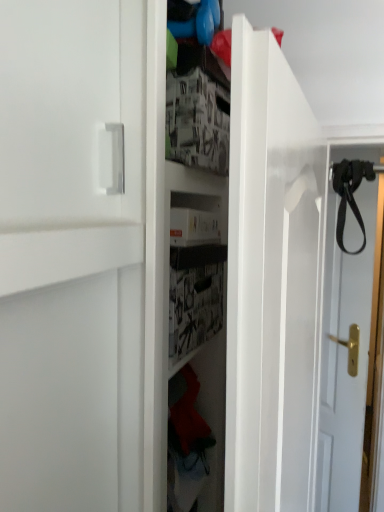
This screenshot has width=384, height=512. What do you see at coordinates (344, 356) in the screenshot?
I see `black leather strap at right` at bounding box center [344, 356].

The width and height of the screenshot is (384, 512). I want to click on black leather strap at right, so click(344, 356).

Measure the distance between black leather strap at right and camera.

1.17 meters.

Locate an element on the screen. The height and width of the screenshot is (512, 384). black leather strap at upper right is located at coordinates (350, 194).

In the scene shown: What is the approximate height of black leather strap at upper right?

The height of black leather strap at upper right is 11.22 inches.

Describe the element at coordinates (350, 194) in the screenshot. This screenshot has height=512, width=384. I see `black leather strap at upper right` at that location.

Locate an element on the screen. black leather strap at right is located at coordinates (344, 356).

Can you confirm if black leather strap at upper right is positioned to the left of black leather strap at right?

Yes.

Relative to black leather strap at right, is black leather strap at upper right in front or behind?

black leather strap at upper right is positioned closer to the viewer than black leather strap at right.

Considering the positions of points (372, 170) and (334, 366), is point (372, 170) closer to camera compared to point (334, 366)?

That is True.

From the image's perspective, which one is positioned higher, black leather strap at upper right or black leather strap at right?

black leather strap at upper right appears higher in the image.

From a real-world perspective, between black leather strap at upper right and black leather strap at right, who is vertically higher?

From a 3D spatial view, black leather strap at upper right is above.

Does black leather strap at upper right have a greater width compared to black leather strap at right?

No, black leather strap at upper right is not wider than black leather strap at right.

Which of these two, black leather strap at upper right or black leather strap at right, stands shorter?

With less height is black leather strap at upper right.

Does black leather strap at upper right have a larger size compared to black leather strap at right?

No, black leather strap at upper right is not bigger than black leather strap at right.

Is black leather strap at upper right inside or outside of black leather strap at right?

black leather strap at upper right exists outside the volume of black leather strap at right.

Is black leather strap at upper right far away from black leather strap at right?

No, black leather strap at upper right is in close proximity to black leather strap at right.

Is black leather strap at upper right aimed at black leather strap at right?

No, black leather strap at upper right is not oriented towards black leather strap at right.

Locate an element on the screen. door lying behind the black leather strap at upper right is located at coordinates (344, 356).

Considering the relative positions of black leather strap at right and black leather strap at upper right in the image provided, is black leather strap at right to the left or to the right of black leather strap at upper right?

In the image, black leather strap at right appears on the right side of black leather strap at upper right.

Considering their positions, is black leather strap at right located in front of or behind black leather strap at upper right?

black leather strap at right is behind black leather strap at upper right.

Which is nearer, (338,440) or (373,170)?

Point (338,440) is positioned farther from the camera compared to point (373,170).

From the image's perspective, does black leather strap at right appear lower than black leather strap at upper right?

Yes, from the image's perspective, black leather strap at right is below black leather strap at upper right.

From a real-world perspective, who is located higher, black leather strap at right or black leather strap at upper right?

black leather strap at upper right, from a real-world perspective.

Which object is thinner, black leather strap at right or black leather strap at upper right?

Thinner between the two is black leather strap at upper right.

Considering the sizes of black leather strap at right and black leather strap at upper right in the image, is black leather strap at right taller or shorter than black leather strap at upper right?

Clearly, black leather strap at right is taller compared to black leather strap at upper right.

Considering the sizes of black leather strap at right and black leather strap at upper right in the image, is black leather strap at right bigger or smaller than black leather strap at upper right?

Considering their sizes, black leather strap at right takes up more space than black leather strap at upper right.

Is black leather strap at upper right completely or partially inside black leather strap at right?

No.

Can you see black leather strap at right touching black leather strap at upper right?

No, black leather strap at right is not making contact with black leather strap at upper right.

Is black leather strap at right oriented towards black leather strap at upper right?

No, black leather strap at right is not facing towards black leather strap at upper right.

Based on the photo, how different are the orientations of black leather strap at right and black leather strap at upper right in degrees?

32.6 degrees.

Based on the photo, how much distance is there between black leather strap at right and black leather strap at upper right?

They are 12.84 inches apart.

Image resolution: width=384 pixels, height=512 pixels. I want to click on door below the black leather strap at upper right (from a real-world perspective), so click(x=344, y=356).

This screenshot has width=384, height=512. I want to click on door on the right of the black leather strap at upper right, so click(x=344, y=356).

Find the location of `strap in front of the black leather strap at right`. strap in front of the black leather strap at right is located at coordinates (350, 194).